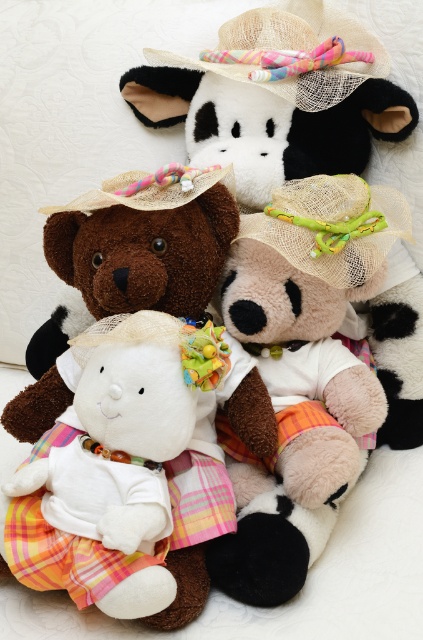
Which of these two, white plush teddy bear at center or straw hat at upper center, stands taller?

white plush teddy bear at center

Between white plush teddy bear at center and straw hat at upper center, which one appears on the left side from the viewer's perspective?

white plush teddy bear at center

Who is more distant from viewer, (118, 176) or (181, 60)?

The point (181, 60) is behind.

You are a GUI agent. You are given a task and a screenshot of the screen. Output one action in this format:
    pyautogui.click(x=<x>, y=<y>)
    Task: Click on the white plush teddy bear at center
    Image resolution: width=423 pixels, height=640 pixels.
    Given the screenshot: What is the action you would take?
    pyautogui.click(x=143, y=243)

Does white plush teddy bear at center have a lesser height compared to braided straw hat at center?

Incorrect, white plush teddy bear at center's height does not fall short of braided straw hat at center's.

Between point (57, 384) and point (406, 218), which one is positioned in front?

Point (57, 384) is in front.

Is point (134, 253) closer to viewer compared to point (312, 179)?

Yes, it is in front of point (312, 179).

This screenshot has width=423, height=640. I want to click on white plush teddy bear at center, so click(x=143, y=243).

Which is in front, point (227, 305) or point (255, 33)?

Point (227, 305) is in front.

Is fluffy beige teddy bear at center in front of straw hat at upper center?

Yes, fluffy beige teddy bear at center is closer to the viewer.

Between point (308, 460) and point (326, 70), which one is positioned in front?

Point (308, 460) is in front.

Identify the location of fluffy beige teddy bear at center. Image resolution: width=423 pixels, height=640 pixels. pos(302,371).